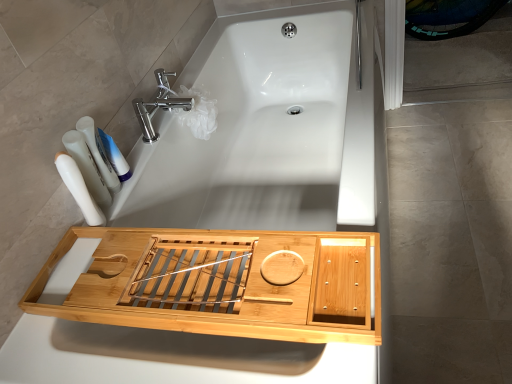
Question: Could you tell me if white plastic bottles at left, placed as the first toiletry when sorted from back to front, is turned towards polished chrome faucet at upper center?

Choices:
 (A) no
 (B) yes

Answer: (A)

Question: Is white plastic bottles at left, placed as the first toiletry when sorted from back to front, far from polished chrome faucet at upper center?

Choices:
 (A) no
 (B) yes

Answer: (A)

Question: From a real-world perspective, is white plastic bottles at left, marked as the third toiletry in a front-to-back arrangement, located beneath polished chrome faucet at upper center?

Choices:
 (A) no
 (B) yes

Answer: (A)

Question: Does white plastic bottles at left, marked as the third toiletry in a front-to-back arrangement, have a larger size compared to polished chrome faucet at upper center?

Choices:
 (A) yes
 (B) no

Answer: (B)

Question: Considering the relative sizes of white plastic bottles at left, placed as the first toiletry when sorted from back to front, and polished chrome faucet at upper center in the image provided, is white plastic bottles at left, placed as the first toiletry when sorted from back to front, wider than polished chrome faucet at upper center?

Choices:
 (A) yes
 (B) no

Answer: (B)

Question: Based on their positions, is white matte toothpaste at upper left located to the left or right of white plastic toothbrushes at left, which appears as the second toiletry when viewed from the back?

Choices:
 (A) right
 (B) left

Answer: (A)

Question: Is white matte toothpaste at upper left inside the boundaries of white plastic toothbrushes at left, which is counted as the second toiletry, starting from the front, or outside?

Choices:
 (A) inside
 (B) outside

Answer: (B)

Question: In terms of size, does white matte toothpaste at upper left appear bigger or smaller than white plastic toothbrushes at left, which is counted as the second toiletry, starting from the front?

Choices:
 (A) big
 (B) small

Answer: (B)

Question: Is white matte toothpaste at upper left taller or shorter than white plastic toothbrushes at left, which appears as the second toiletry when viewed from the back?

Choices:
 (A) short
 (B) tall

Answer: (A)

Question: Considering the positions of white plastic bottles at left, placed as the first toiletry when sorted from back to front, and natural wood tray at center in the image, is white plastic bottles at left, placed as the first toiletry when sorted from back to front, taller or shorter than natural wood tray at center?

Choices:
 (A) tall
 (B) short

Answer: (A)

Question: Does point (100, 162) appear closer or farther from the camera than point (31, 309)?

Choices:
 (A) farther
 (B) closer

Answer: (A)

Question: Would you say white plastic bottles at left, placed as the first toiletry when sorted from back to front, is inside or outside natural wood tray at center?

Choices:
 (A) inside
 (B) outside

Answer: (B)

Question: Is white plastic bottles at left, marked as the third toiletry in a front-to-back arrangement, to the left or to the right of natural wood tray at center in the image?

Choices:
 (A) right
 (B) left

Answer: (B)

Question: In the image, is polished chrome faucet at upper center on the left side or the right side of white plastic bottles at left, placed as the first toiletry when sorted from back to front?

Choices:
 (A) right
 (B) left

Answer: (A)

Question: Is polished chrome faucet at upper center taller or shorter than white plastic bottles at left, placed as the first toiletry when sorted from back to front?

Choices:
 (A) short
 (B) tall

Answer: (A)